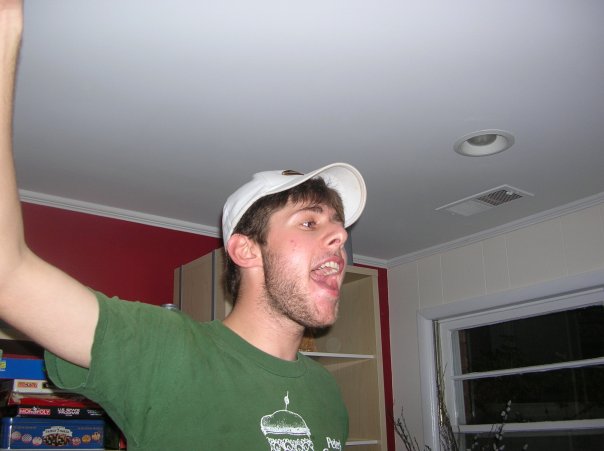
This screenshot has width=604, height=451. I want to click on walls, so click(x=127, y=262), click(x=425, y=276).